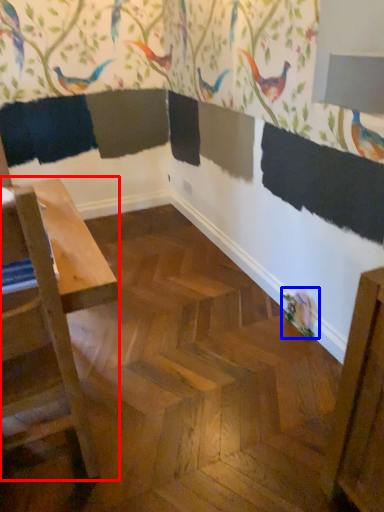
Question: Which point is further to the camera, table (highlighted by a red box) or bird (highlighted by a blue box)?

Choices:
 (A) table
 (B) bird

Answer: (B)